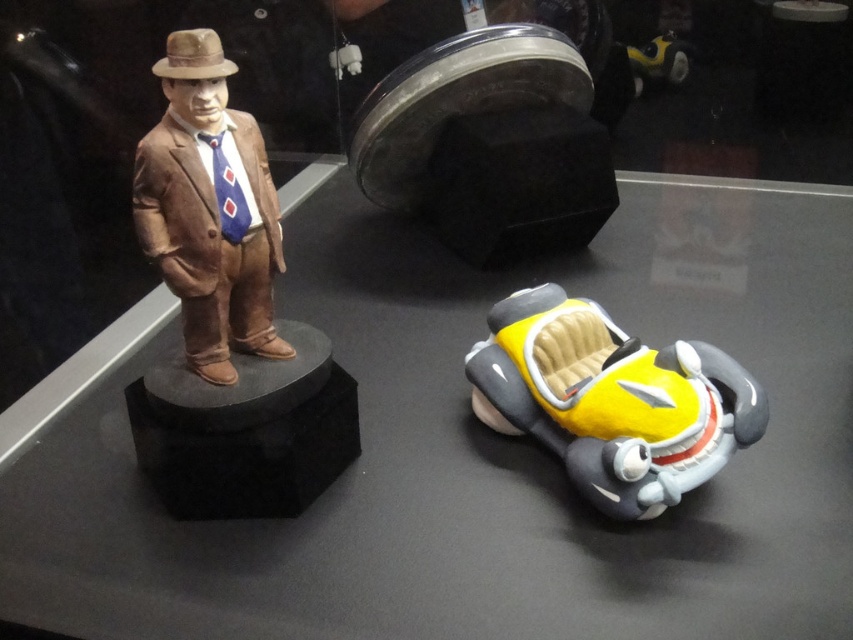
Question: Does yellow matte car at lower right appear on the left side of matte brown statue at left?

Choices:
 (A) no
 (B) yes

Answer: (A)

Question: Considering the relative positions of yellow matte car at lower right and matte brown statue at left in the image provided, where is yellow matte car at lower right located with respect to matte brown statue at left?

Choices:
 (A) right
 (B) left

Answer: (A)

Question: Does yellow matte car at lower right appear on the right side of matte brown statue at left?

Choices:
 (A) no
 (B) yes

Answer: (B)